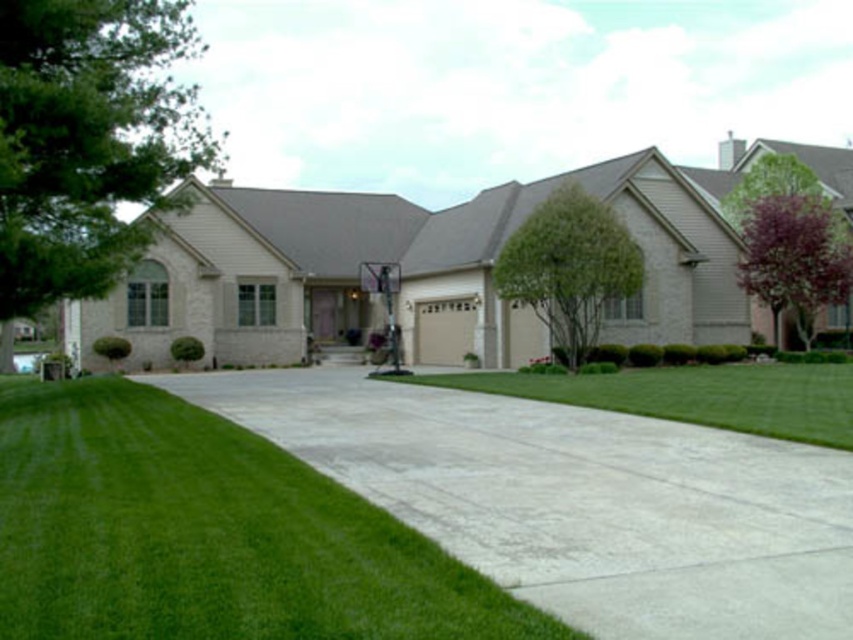
Does green leafy tree at center have a smaller size compared to purple leafy tree at right?

Yes.

Is point (503, 292) positioned in front of point (833, 232)?

That is True.

What are the coordinates of `green leafy tree at center` in the screenshot? It's located at (567, 268).

Is point (486, 376) positioned behind point (587, 234)?

No, it is in front of (587, 234).

Between green grass at center and green leafy tree at center, which one has more height?

green grass at center

Measure the distance between point [567,394] and camera.

17.92 meters

At what (x,y) coordinates should I click in order to perform the action: click on green grass at center. Please return your answer as a coordinate pair (x, y). Looking at the image, I should click on (694, 396).

Can you confirm if green grass at center is shorter than purple leafy tree at right?

Correct, green grass at center is not as tall as purple leafy tree at right.

Can you confirm if green grass at center is positioned to the left of purple leafy tree at right?

Correct, you'll find green grass at center to the left of purple leafy tree at right.

Identify the location of green grass at center. (694, 396).